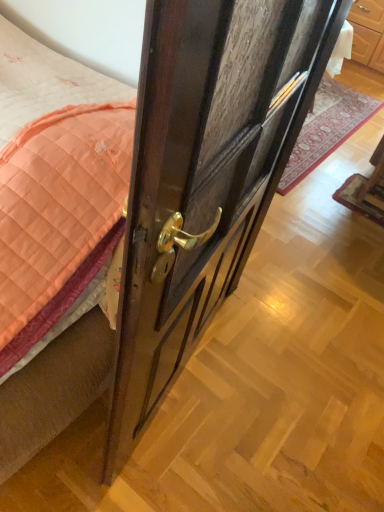
Question: From a real-world perspective, is dark wood door at center under wooden chair at lower right?

Choices:
 (A) yes
 (B) no

Answer: (B)

Question: Does dark wood door at center have a greater width compared to wooden chair at lower right?

Choices:
 (A) no
 (B) yes

Answer: (A)

Question: Can we say dark wood door at center lies outside wooden chair at lower right?

Choices:
 (A) yes
 (B) no

Answer: (A)

Question: Does dark wood door at center have a greater height compared to wooden chair at lower right?

Choices:
 (A) yes
 (B) no

Answer: (A)

Question: Does dark wood door at center appear on the right side of wooden chair at lower right?

Choices:
 (A) yes
 (B) no

Answer: (B)

Question: Is dark wood door at center aimed at wooden chair at lower right?

Choices:
 (A) no
 (B) yes

Answer: (A)

Question: Is wooden chair at lower right positioned before dark wood door at center?

Choices:
 (A) yes
 (B) no

Answer: (B)

Question: Is wooden chair at lower right turned away from dark wood door at center?

Choices:
 (A) yes
 (B) no

Answer: (B)

Question: Is wooden chair at lower right far away from dark wood door at center?

Choices:
 (A) no
 (B) yes

Answer: (B)

Question: From a real-world perspective, is wooden chair at lower right on dark wood door at center?

Choices:
 (A) yes
 (B) no

Answer: (B)

Question: Is the position of wooden chair at lower right more distant than that of dark wood door at center?

Choices:
 (A) no
 (B) yes

Answer: (B)

Question: Can you confirm if wooden chair at lower right is smaller than dark wood door at center?

Choices:
 (A) yes
 (B) no

Answer: (A)

Question: Is dark wood door at center placed right next to wooden door handle at center?

Choices:
 (A) yes
 (B) no

Answer: (B)